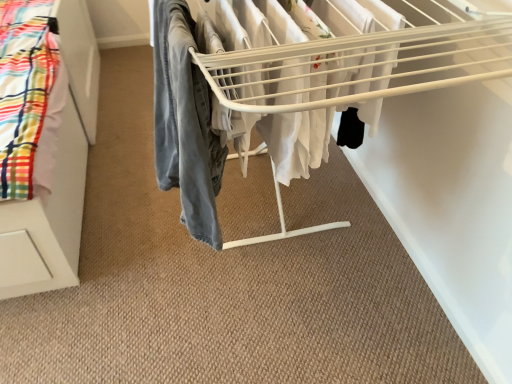
Find the location of a particular element. This screenshot has width=512, height=384. denim pants at center is located at coordinates (185, 123).

What do you see at coordinates (185, 123) in the screenshot? The width and height of the screenshot is (512, 384). I see `denim pants at center` at bounding box center [185, 123].

What do you see at coordinates (279, 94) in the screenshot? I see `white plastic drying rack at center` at bounding box center [279, 94].

Find the location of a particular element. white plastic drying rack at center is located at coordinates (279, 94).

The width and height of the screenshot is (512, 384). I want to click on denim pants at center, so click(185, 123).

Can you confirm if denim pants at center is positioned to the right of white plastic drying rack at center?

No, denim pants at center is not to the right of white plastic drying rack at center.

Looking at this image, is the depth of denim pants at center greater than that of white plastic drying rack at center?

Yes, the depth of denim pants at center is greater than that of white plastic drying rack at center.

Which point is more distant from viewer, (203,95) or (246,94)?

Positioned behind is point (246,94).

From the image's perspective, is denim pants at center above or below white plastic drying rack at center?

Clearly, from the image's perspective, denim pants at center is below white plastic drying rack at center.

From a real-world perspective, who is located lower, denim pants at center or white plastic drying rack at center?

white plastic drying rack at center.

Considering the sizes of objects denim pants at center and white plastic drying rack at center in the image provided, who is wider, denim pants at center or white plastic drying rack at center?

white plastic drying rack at center is wider.

Does denim pants at center have a greater height compared to white plastic drying rack at center?

No, denim pants at center is not taller than white plastic drying rack at center.

Is denim pants at center bigger or smaller than white plastic drying rack at center?

In the image, denim pants at center appears to be smaller than white plastic drying rack at center.

Is denim pants at center located outside white plastic drying rack at center?

No.

Would you say denim pants at center is a long distance from white plastic drying rack at center?

That's not correct — denim pants at center is a little close to white plastic drying rack at center.

Could you tell me if denim pants at center is turned towards white plastic drying rack at center?

No, denim pants at center is not oriented towards white plastic drying rack at center.

What's the angular difference between denim pants at center and white plastic drying rack at center's facing directions?

The facing directions of denim pants at center and white plastic drying rack at center are 0.00112 degrees apart.

The width and height of the screenshot is (512, 384). I want to click on clothing behind the white plastic drying rack at center, so click(185, 123).

Between white plastic drying rack at center and denim pants at center, which one appears on the right side from the viewer's perspective?

From the viewer's perspective, white plastic drying rack at center appears more on the right side.

Which object is further away from the camera taking this photo, white plastic drying rack at center or denim pants at center?

denim pants at center is further away from the camera.

Considering the points (468, 37) and (193, 106), which point is in front, point (468, 37) or point (193, 106)?

Point (193, 106)

From the image's perspective, is white plastic drying rack at center under denim pants at center?

Incorrect, from the image's perspective, white plastic drying rack at center is higher than denim pants at center.

In the scene shown: From a real-world perspective, relative to denim pants at center, is white plastic drying rack at center vertically above or below?

white plastic drying rack at center is below denim pants at center.

Is white plastic drying rack at center wider than denim pants at center?

Yes, white plastic drying rack at center is wider than denim pants at center.

Who is taller, white plastic drying rack at center or denim pants at center?

white plastic drying rack at center.

Can you confirm if white plastic drying rack at center is bigger than denim pants at center?

Yes.

Does white plastic drying rack at center contain denim pants at center?

Yes, denim pants at center can be found within white plastic drying rack at center.

Are white plastic drying rack at center and denim pants at center far apart?

That's not correct — white plastic drying rack at center is a little close to denim pants at center.

Is white plastic drying rack at center turned away from denim pants at center?

Absolutely, white plastic drying rack at center is directed away from denim pants at center.

The image size is (512, 384). Identify the location of bunk bed that is above the denim pants at center (from the image's perspective). (279, 94).

What are the coordinates of `clothing located above the white plastic drying rack at center (from a real-world perspective)` in the screenshot? It's located at (185, 123).

Image resolution: width=512 pixels, height=384 pixels. Identify the location of bunk bed on the right of denim pants at center. point(279,94).